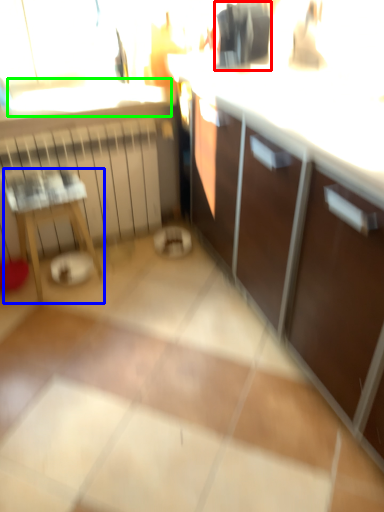
Question: Which object is positioned farthest from appliance (highlighted by a red box)? Select from furniture (highlighted by a blue box) and window sill (highlighted by a green box).

Choices:
 (A) furniture
 (B) window sill

Answer: (A)